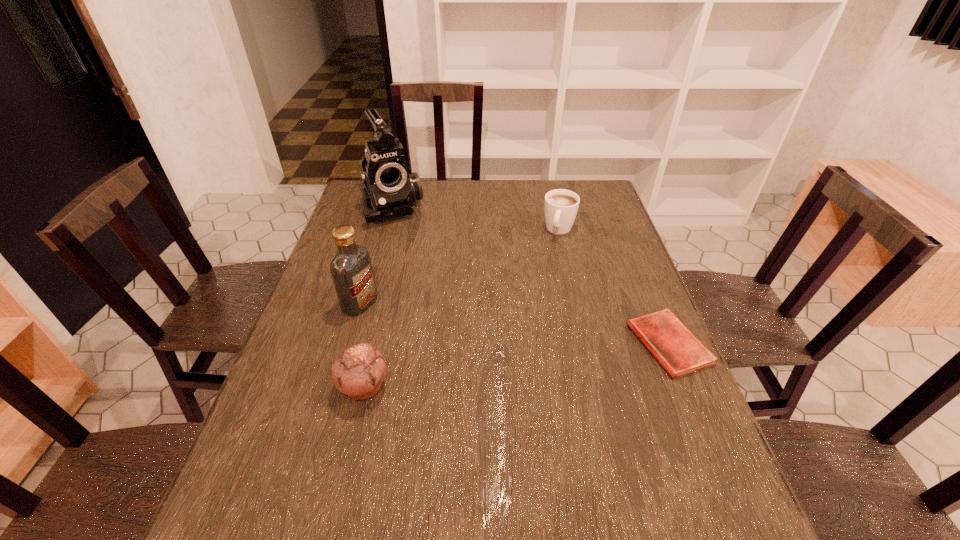
This screenshot has width=960, height=540. I want to click on muffin, so click(359, 371).

Find the location of `the shortest object`. the shortest object is located at coordinates (676, 348).

At what (x,y) coordinates should I click in order to perform the action: click on diary. Please return your answer as a coordinate pair (x, y). The width and height of the screenshot is (960, 540). Looking at the image, I should click on (676, 348).

Image resolution: width=960 pixels, height=540 pixels. I want to click on the second object from right to left, so click(x=560, y=206).

Where is `the second tallest object`? This screenshot has width=960, height=540. the second tallest object is located at coordinates (351, 269).

In order to click on camcorder in this screenshot , I will do `click(390, 190)`.

Where is `free location located on the front of the muffin`? free location located on the front of the muffin is located at coordinates (346, 464).

This screenshot has width=960, height=540. I want to click on vacant space located on the front of the rightmost object, so click(x=713, y=451).

Where is `free space located 0.110m with the handle on the side of the cappuccino`? This screenshot has width=960, height=540. free space located 0.110m with the handle on the side of the cappuccino is located at coordinates (549, 262).

Where is `free space located with the handle on the side of the cappuccino`? Image resolution: width=960 pixels, height=540 pixels. free space located with the handle on the side of the cappuccino is located at coordinates (526, 331).